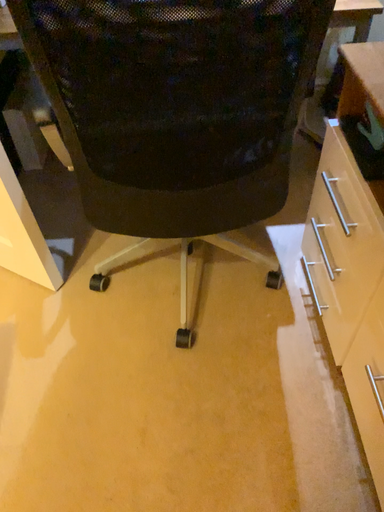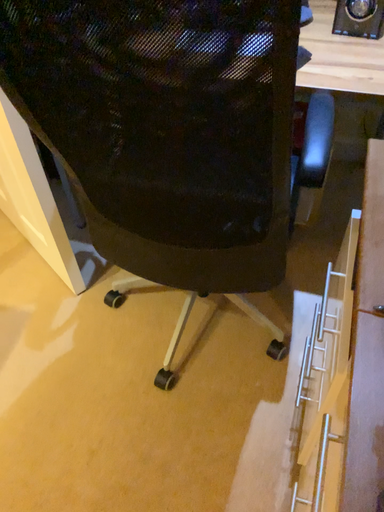
Question: Which way did the camera rotate in the video?

Choices:
 (A) rotated left
 (B) rotated right

Answer: (A)